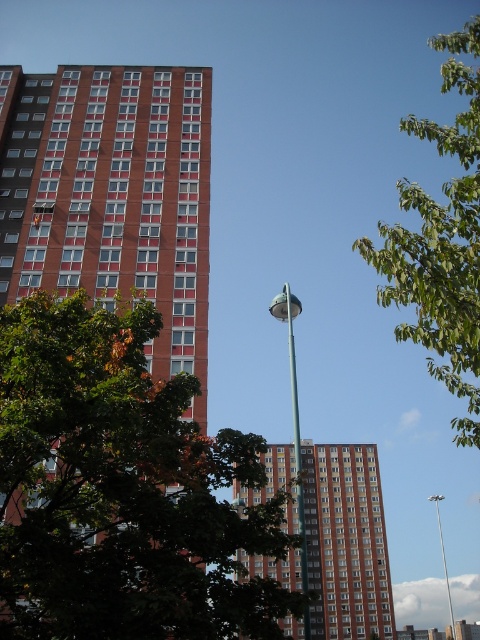
You are a city planner assessing the urban layout. There is a point at coordinates (x=120, y=490) between the two buildings. What object is located at this point?

At point (x=120, y=490) lies a green leafy tree at center.

From the picture: You are a drone operator trying to deliver a package between the two buildings. The delivery point is marked by point (x=61, y=582) and point (x=459, y=129). Which point should you aim for to ensure the shortest flight path?

Point (x=61, y=582) is closer to the camera than point (x=459, y=129), so you should aim for point (x=61, y=582) to ensure the shortest flight path.

You are a delivery drone flying over the urban scene. You need to deliver a package to a point between the two buildings. The coordinates of the two points are point (425, 275) and point (451, 604). Which point is closer to the front of the scene?

Point (425, 275) is in front of point (451, 604), so it is closer to the front of the scene.